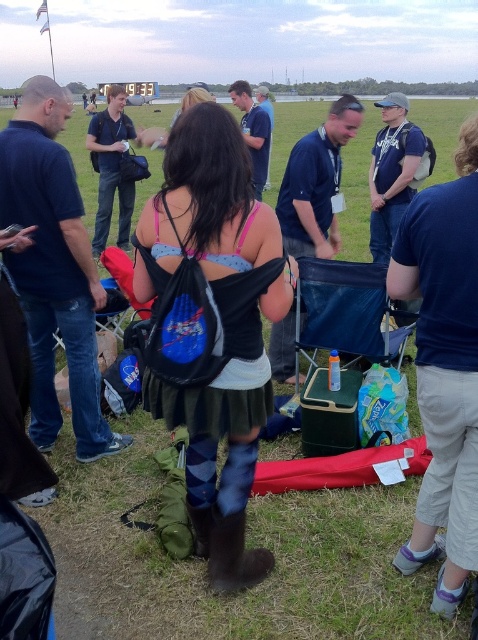
Is point (402, 275) positioned behind point (292, 346)?

No, (402, 275) is closer to viewer.

Is point (470, 116) in front of point (330, 228)?

No, it is behind (330, 228).

Is point (437, 435) in front of point (350, 100)?

Yes.

The height and width of the screenshot is (640, 478). I want to click on dark blue t-shirt at center, so click(x=445, y=368).

Which of these two, dark blue t-shirt at center or matte black jacket at center, stands taller?

With more height is matte black jacket at center.

Find the location of a particular element. This screenshot has width=478, height=640. dark blue t-shirt at center is located at coordinates 445,368.

Is denim skirt at center above dark blue shirt at left?

No.

Between denim skirt at center and dark blue shirt at left, which one is positioned lower?

denim skirt at center is below.

Does point (152, 288) come closer to viewer compared to point (44, 442)?

Yes, point (152, 288) is in front of point (44, 442).

Where is `denim skirt at center`? denim skirt at center is located at coordinates (212, 324).